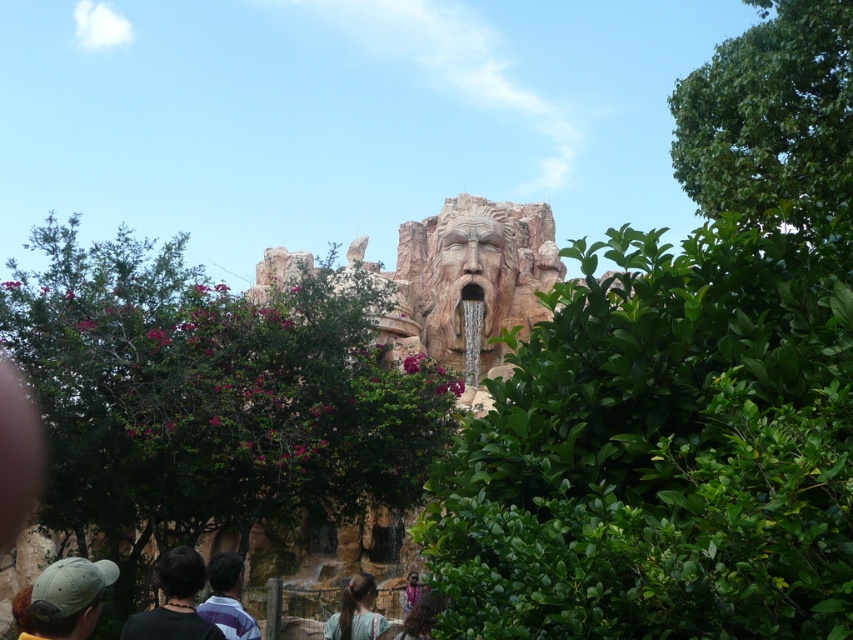
You are standing in front of the stone face structure and see the green leafy tree at upper right and the purple cotton shirt at lower center. Which object is positioned to the right side of the other?

The green leafy tree at upper right is positioned to the right of the purple cotton shirt at lower center.

You are standing in front of the brown stone face at center and the brown hair at lower center. Which object is closer to you?

The brown stone face at center is closer to you than the brown hair at lower center.